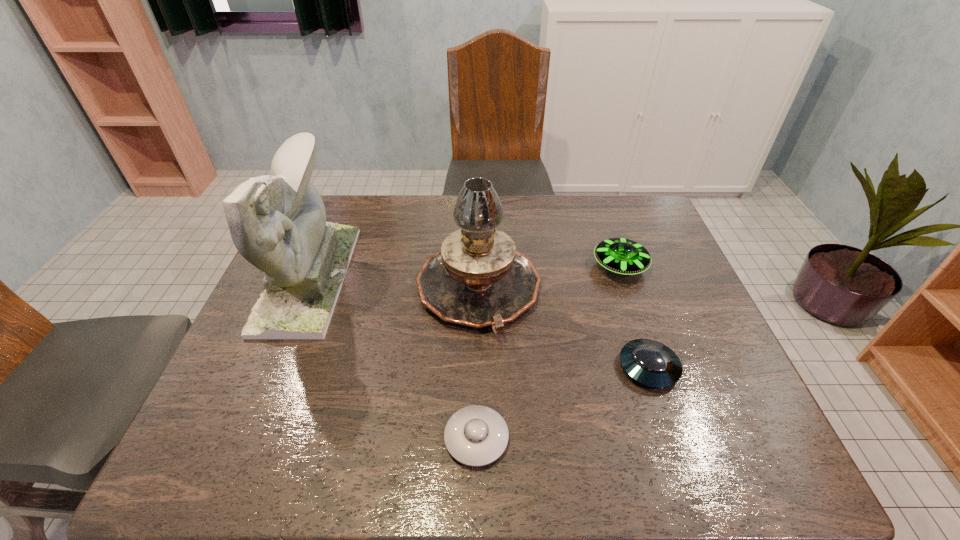
Select which object appears as the second closest to the leftmost object. Please provide its 2D coordinates. Your answer should be formatted as a tuple, i.e. [(x, y)], where the tuple contains the x and y coordinates of a point satisfying the conditions above.

[(476, 435)]

This screenshot has height=540, width=960. Find the location of `object that can be found as the closest to the tallest object`. object that can be found as the closest to the tallest object is located at coordinates (478, 279).

Where is `the closest saucer to the tallest saucer`? The height and width of the screenshot is (540, 960). the closest saucer to the tallest saucer is located at coordinates (650, 363).

Select which saucer appears as the closest to the second nearest object. Please provide its 2D coordinates. Your answer should be formatted as a tuple, i.e. [(x, y)], where the tuple contains the x and y coordinates of a point satisfying the conditions above.

[(623, 256)]

Where is `vacant space that satisfies the following two spatial constraints: 1. on the base of the tallest object; 2. on the back side of the nearest object`? The height and width of the screenshot is (540, 960). vacant space that satisfies the following two spatial constraints: 1. on the base of the tallest object; 2. on the back side of the nearest object is located at coordinates (243, 438).

What are the coordinates of `vacant space that satisfies the following two spatial constraints: 1. on the base of the tallest object; 2. on the back side of the second nearest saucer` in the screenshot? It's located at (272, 367).